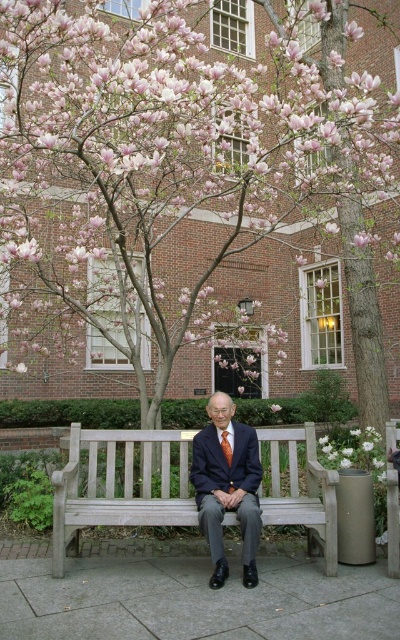
You are standing at the point marked as point(181, 166). What is the nearest object to you?

The nearest object to point(181, 166) is the pink blossom tree at center since the point is located on it.

You are an artist sketching the scene. You need to decide which object to draw first based on their sizes. Which one should you start with, the pink blossom tree at center or the dark blue suit at center?

The pink blossom tree at center is larger in size than the dark blue suit at center, so you should start with the pink blossom tree at center to capture its full structure before detailing the smaller elements like the dark blue suit at center.

Looking at this image, you are a photographer standing in front of the brick building. You want to take a picture of the dark blue suit at center and the wooden bench at center so that both are clearly visible. Based on their positions, which object should be placed closer to the camera to ensure both are in focus?

The wooden bench at center is located below the dark blue suit at center, so to ensure both are in focus, the photographer should position the camera so that both are at a similar distance. Since the bench is below the suit, adjusting the camera angle downward slightly would help capture both clearly.